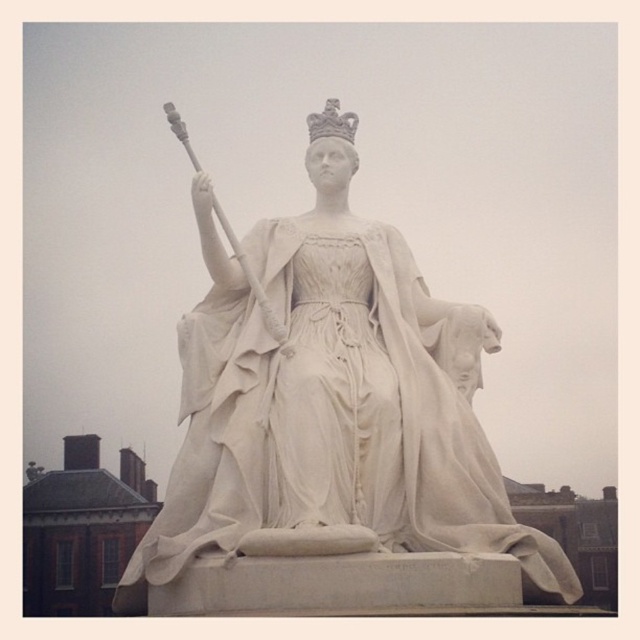
You are standing in front of the statue and see two points marked on it. The first point is at coordinates point (554, 566) and the second point is at point (321, 122). Which point is closer to you?

Point (554, 566) is in front of point (321, 122), so it is closer to you.

You are an art conservator examining the statue. You need to clean both the white marble statue at center and the white stone crown at upper center. Which object is closer to you so you can start cleaning first?

The white marble statue at center is closer to the viewer than the white stone crown at upper center, so you should start cleaning the white marble statue at center first.

You are a photographer standing at a certain position and want to capture a detailed closeup of the white marble statue at center. The camera you are using has a minimum focusing distance of 40 meters. Can you take the closeup without moving closer?

The white marble statue at center and camera are 40.12 meters apart from each other. Since the minimum focusing distance is 40 meters, the statue is just slightly beyond the camera range. Therefore, you cannot take the closeup without moving closer.